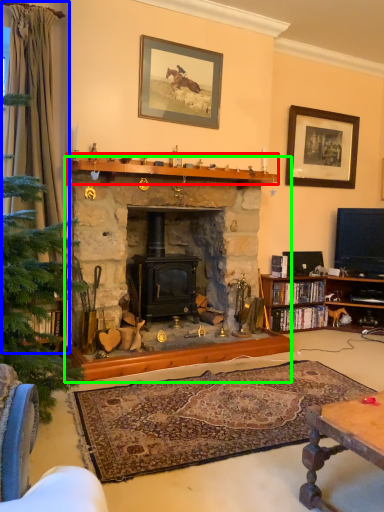
Question: Estimate the real-world distances between objects in this image. Which object is farther from mantle (highlighted by a red box), curtain (highlighted by a blue box) or fireplace (highlighted by a green box)?

Choices:
 (A) curtain
 (B) fireplace

Answer: (A)